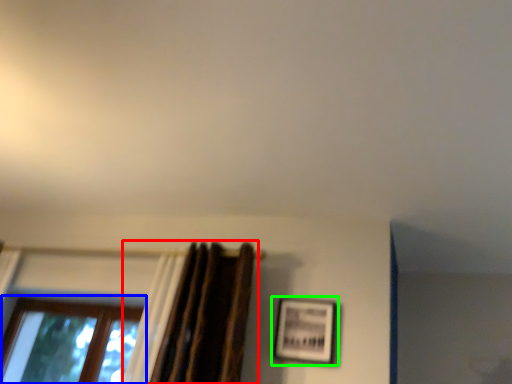
Question: Which object is positioned farthest from curtain (highlighted by a red box)? Select from window (highlighted by a blue box) and picture frame (highlighted by a green box).

Choices:
 (A) window
 (B) picture frame

Answer: (A)